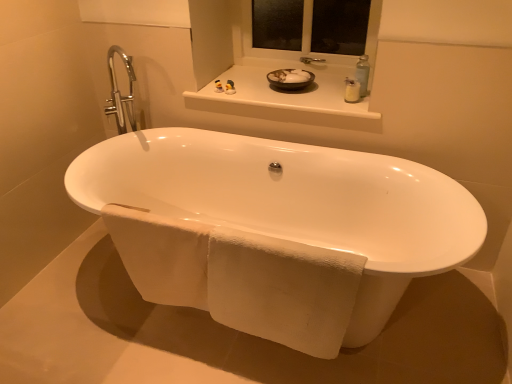
Locate an element on the screen. The image size is (512, 384). matte rubber duck at upper center, which is counted as the second toiletry, starting from the front is located at coordinates (218, 86).

Measure the distance between point [352,55] and camera.

The distance of point [352,55] from camera is 2.36 meters.

What do you see at coordinates (352, 90) in the screenshot? I see `white plastic soap dispenser at upper right, marked as the second toiletry in a left-to-right arrangement` at bounding box center [352, 90].

Describe the element at coordinates (285, 94) in the screenshot. I see `white glossy window sill at upper center` at that location.

What do you see at coordinates (240, 278) in the screenshot? This screenshot has height=384, width=512. I see `white textured towel at lower center` at bounding box center [240, 278].

Find the location of a particular element. Image resolution: width=512 pixels, height=384 pixels. white glossy bathtub at center is located at coordinates (275, 230).

Where is `matte rubber duck at upper center, acting as the second toiletry starting from the right`? The width and height of the screenshot is (512, 384). matte rubber duck at upper center, acting as the second toiletry starting from the right is located at coordinates pos(218,86).

In the image, is white plastic soap dispenser at upper right, the second toiletry in the back-to-front sequence, positioned in front of or behind white plastic window frame at upper center?

white plastic soap dispenser at upper right, the second toiletry in the back-to-front sequence, is positioned closer to the viewer than white plastic window frame at upper center.

From the image's perspective, is white plastic soap dispenser at upper right, the second toiletry in the back-to-front sequence, located above or below white plastic window frame at upper center?

Based on their image positions, white plastic soap dispenser at upper right, the second toiletry in the back-to-front sequence, is located beneath white plastic window frame at upper center.

Based on the photo, considering the relative positions of white plastic soap dispenser at upper right, arranged as the first toiletry when viewed from the front, and white plastic window frame at upper center in the image provided, is white plastic soap dispenser at upper right, arranged as the first toiletry when viewed from the front, to the right of white plastic window frame at upper center from the viewer's perspective?

Correct, you'll find white plastic soap dispenser at upper right, arranged as the first toiletry when viewed from the front, to the right of white plastic window frame at upper center.

Does white plastic window frame at upper center have a larger size compared to white plastic soap dispenser at upper right, arranged as the first toiletry when viewed from the front?

Indeed, white plastic window frame at upper center has a larger size compared to white plastic soap dispenser at upper right, arranged as the first toiletry when viewed from the front.

Considering the sizes of objects white plastic window frame at upper center and white plastic soap dispenser at upper right, the first toiletry when ordered from right to left, in the image provided, who is shorter, white plastic window frame at upper center or white plastic soap dispenser at upper right, the first toiletry when ordered from right to left,?

With less height is white plastic soap dispenser at upper right, the first toiletry when ordered from right to left.

How different are the orientations of white plastic window frame at upper center and white plastic soap dispenser at upper right, arranged as the first toiletry when viewed from the front, in degrees?

The facing directions of white plastic window frame at upper center and white plastic soap dispenser at upper right, arranged as the first toiletry when viewed from the front, are 7.08 degrees apart.

In the scene shown: Is white plastic window frame at upper center positioned far away from white plastic soap dispenser at upper right, the second toiletry in the back-to-front sequence?

white plastic window frame at upper center is actually quite close to white plastic soap dispenser at upper right, the second toiletry in the back-to-front sequence.

Does white plastic window frame at upper center have a larger size compared to white glossy bowl at upper center?

Indeed, white plastic window frame at upper center has a larger size compared to white glossy bowl at upper center.

Considering the positions of points (285, 28) and (295, 72), is point (285, 28) closer to camera compared to point (295, 72)?

No, (285, 28) is further to viewer.

Considering the positions of objects white plastic window frame at upper center and white glossy bowl at upper center in the image provided, who is in front, white plastic window frame at upper center or white glossy bowl at upper center?

Positioned in front is white glossy bowl at upper center.

Which of these two, white plastic window frame at upper center or white glossy bowl at upper center, is wider?

Wider between the two is white glossy bowl at upper center.

Are white textured towel at lower center and white plastic window frame at upper center far apart?

Yes, white textured towel at lower center and white plastic window frame at upper center are quite far apart.

Is white textured towel at lower center bigger or smaller than white plastic window frame at upper center?

white textured towel at lower center is smaller than white plastic window frame at upper center.

Would you say white textured towel at lower center is to the left or to the right of white plastic window frame at upper center in the picture?

From the image, it's evident that white textured towel at lower center is to the left of white plastic window frame at upper center.

Is white textured towel at lower center shorter than white plastic soap dispenser at upper right, marked as the second toiletry in a left-to-right arrangement?

In fact, white textured towel at lower center may be taller than white plastic soap dispenser at upper right, marked as the second toiletry in a left-to-right arrangement.

Does white textured towel at lower center appear on the right side of white plastic soap dispenser at upper right, the first toiletry when ordered from right to left?

No.

Is white textured towel at lower center further to the viewer compared to white plastic soap dispenser at upper right, marked as the second toiletry in a left-to-right arrangement?

No, white textured towel at lower center is closer to the camera.

Which point is more forward, (128, 232) or (358, 84)?

The point (128, 232) is closer.

In terms of height, does white textured towel at lower center look taller or shorter compared to white glossy bathtub at center?

In the image, white textured towel at lower center appears to be shorter than white glossy bathtub at center.

Locate an element on the screen. bathtub on the left of white textured towel at lower center is located at coordinates (275, 230).

Between white textured towel at lower center and white glossy bathtub at center, which one has smaller width?

With smaller width is white textured towel at lower center.

The image size is (512, 384). In order to click on toiletry below the white glossy bowl at upper center (from a real-world perspective) in this screenshot , I will do `click(218, 86)`.

From a real-world perspective, which is physically above, white glossy bowl at upper center or matte rubber duck at upper center, which is counted as the second toiletry, starting from the front?

From a 3D spatial view, white glossy bowl at upper center is above.

From the image's perspective, between white glossy bowl at upper center and matte rubber duck at upper center, which appears as the 1th toiletry when viewed from the left, who is located below?

matte rubber duck at upper center, which appears as the 1th toiletry when viewed from the left.

Is white glossy bowl at upper center facing away from matte rubber duck at upper center, which is counted as the second toiletry, starting from the front?

No, white glossy bowl at upper center is not facing away from matte rubber duck at upper center, which is counted as the second toiletry, starting from the front.

Locate an element on the screen. window frame located above the white plastic soap dispenser at upper right, marked as the second toiletry in a left-to-right arrangement (from a real-world perspective) is located at coordinates (313, 28).

The image size is (512, 384). Find the location of `toiletry that appears in front of the white plastic window frame at upper center`. toiletry that appears in front of the white plastic window frame at upper center is located at coordinates (352, 90).

Consider the image. Which object lies nearer to the anchor point white plastic window frame at upper center, white glossy bathtub at center or white glossy bowl at upper center?

Based on the image, white glossy bowl at upper center appears to be nearer to white plastic window frame at upper center.

When comparing their distances from white glossy bathtub at center, does matte rubber duck at upper center, which appears as the 1th toiletry when viewed from the left, or white textured towel at lower center seem further?

Based on the image, matte rubber duck at upper center, which appears as the 1th toiletry when viewed from the left, appears to be further to white glossy bathtub at center.

From the picture: Estimate the real-world distances between objects in this image. Which object is closer to white plastic soap dispenser at upper right, the first toiletry when ordered from right to left, white glossy bathtub at center or white plastic window frame at upper center?

Based on the image, white plastic window frame at upper center appears to be nearer to white plastic soap dispenser at upper right, the first toiletry when ordered from right to left.

Considering their positions, is white glossy bathtub at center positioned further to white glossy bowl at upper center than white glossy window sill at upper center?

white glossy bathtub at center is further to white glossy bowl at upper center.

Estimate the real-world distances between objects in this image. Which object is further from white glossy window sill at upper center, white glossy bathtub at center or white plastic soap dispenser at upper right, the second toiletry in the back-to-front sequence?

white glossy bathtub at center lies further to white glossy window sill at upper center than the other object.

Looking at the image, which one is located closer to white glossy window sill at upper center, white glossy bowl at upper center or white plastic window frame at upper center?

Based on the image, white glossy bowl at upper center appears to be nearer to white glossy window sill at upper center.

Considering their positions, is white glossy window sill at upper center positioned further to matte rubber duck at upper center, which appears as the 1th toiletry when viewed from the left, than white glossy bowl at upper center?

Based on the image, white glossy bowl at upper center appears to be further to matte rubber duck at upper center, which appears as the 1th toiletry when viewed from the left.

Estimate the real-world distances between objects in this image. Which object is further from white glossy window sill at upper center, white plastic soap dispenser at upper right, the second toiletry in the back-to-front sequence, or white glossy bathtub at center?

white glossy bathtub at center lies further to white glossy window sill at upper center than the other object.

You are a GUI agent. You are given a task and a screenshot of the screen. Output one action in this format:
    pyautogui.click(x=<x>, y=<y>)
    Task: Click on the bath towel between white glossy bathtub at center and matte rubber duck at upper center, acting as the first toiletry starting from the back, from front to back
    The height and width of the screenshot is (384, 512).
    Given the screenshot: What is the action you would take?
    tap(240, 278)

Find the location of `window sill between white plastic window frame at upper center and white plastic soap dispenser at upper right, marked as the second toiletry in a left-to-right arrangement, from top to bottom`. window sill between white plastic window frame at upper center and white plastic soap dispenser at upper right, marked as the second toiletry in a left-to-right arrangement, from top to bottom is located at coordinates (285, 94).

The width and height of the screenshot is (512, 384). Identify the location of sink between white plastic window frame at upper center and white textured towel at lower center in the vertical direction. (290, 79).

I want to click on bathtub between white glossy bowl at upper center and white textured towel at lower center from top to bottom, so click(x=275, y=230).